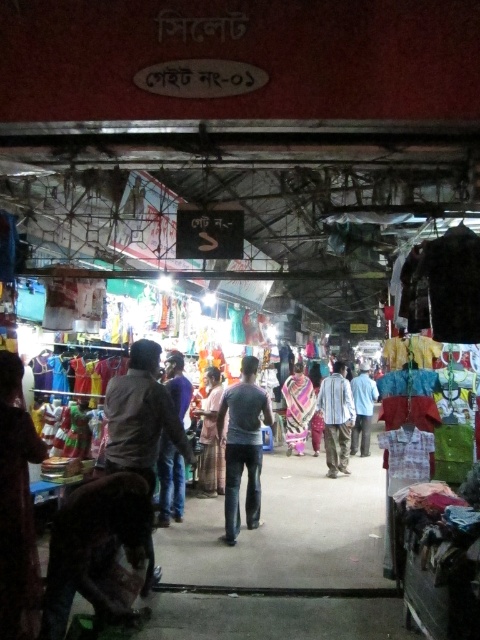
Question: Considering the real-world distances, which object is closest to the light blue shirt at center?

Choices:
 (A) purple cotton shirt at center
 (B) striped cotton shirt at center

Answer: (B)

Question: Is purple cotton shirt at center thinner than multicolored woven cloth at center?

Choices:
 (A) yes
 (B) no

Answer: (A)

Question: Based on their relative distances, which object is farther from the purple cotton shirt at center?

Choices:
 (A) brown cotton dress at center
 (B) multicolored woven cloth at center
 (C) dark gray cotton shirt at center

Answer: (B)

Question: Is dark gray cotton shirt at center thinner than light blue shirt at center?

Choices:
 (A) yes
 (B) no

Answer: (B)

Question: Which of these objects is positioned closest to the brown cotton dress at center?

Choices:
 (A) dark gray cotton shirt at center
 (B) striped cotton shirt at center

Answer: (A)

Question: Is striped cotton shirt at center wider than multicolored woven cloth at center?

Choices:
 (A) yes
 (B) no

Answer: (B)